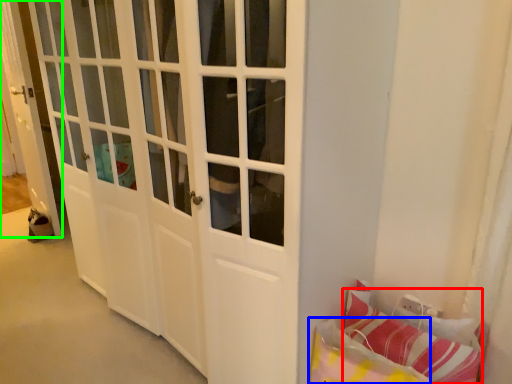
Question: Which object is the farthest from pillow (highlighted by a red box)? Choose among these: pillow (highlighted by a blue box) or door (highlighted by a green box).

Choices:
 (A) pillow
 (B) door

Answer: (B)